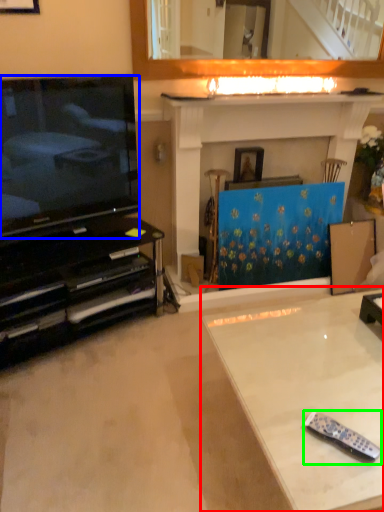
Question: Estimate the real-world distances between objects in this image. Which object is closer to table (highlighted by a red box), television (highlighted by a blue box) or remote control (highlighted by a green box)?

Choices:
 (A) television
 (B) remote control

Answer: (B)